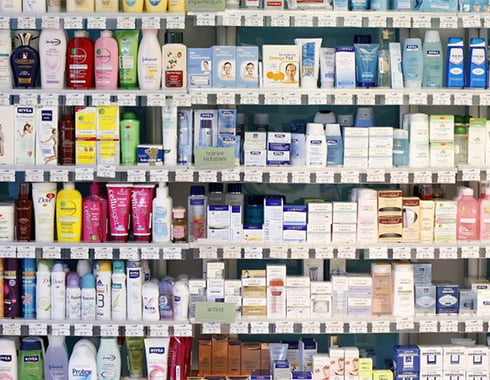
Find the location of `shelf`. shelf is located at coordinates (382, 19), (390, 175), (400, 248), (397, 324), (392, 376), (396, 97).